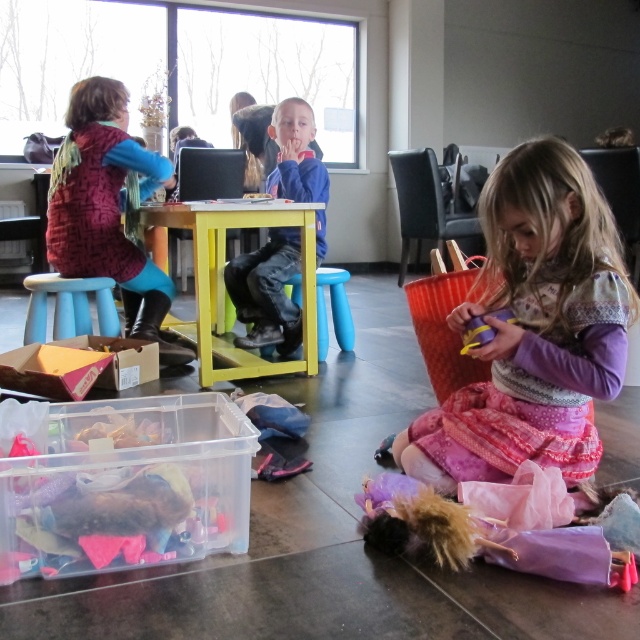
Question: Which object is positioned closest to the velvety maroon sweater at left?

Choices:
 (A) blue fleece jacket at center
 (B) yellow painted wood table at center
 (C) blue plastic stool at center
 (D) pink fabric dress at lower right

Answer: (B)

Question: Does velvety maroon sweater at left come behind blue plastic stool at center?

Choices:
 (A) no
 (B) yes

Answer: (B)

Question: Based on their relative distances, which object is nearer to the blue fleece jacket at center?

Choices:
 (A) blue plastic stool at center
 (B) blue plastic stool at lower left
 (C) pink fabric dress at lower right

Answer: (A)

Question: Is yellow painted wood table at center further to camera compared to blue fleece jacket at center?

Choices:
 (A) yes
 (B) no

Answer: (B)

Question: Which is farther from the pink fabric dress at lower right?

Choices:
 (A) blue fleece jacket at center
 (B) blue plastic stool at center

Answer: (A)

Question: Can you confirm if yellow painted wood table at center is positioned above blue fleece jacket at center?

Choices:
 (A) yes
 (B) no

Answer: (B)